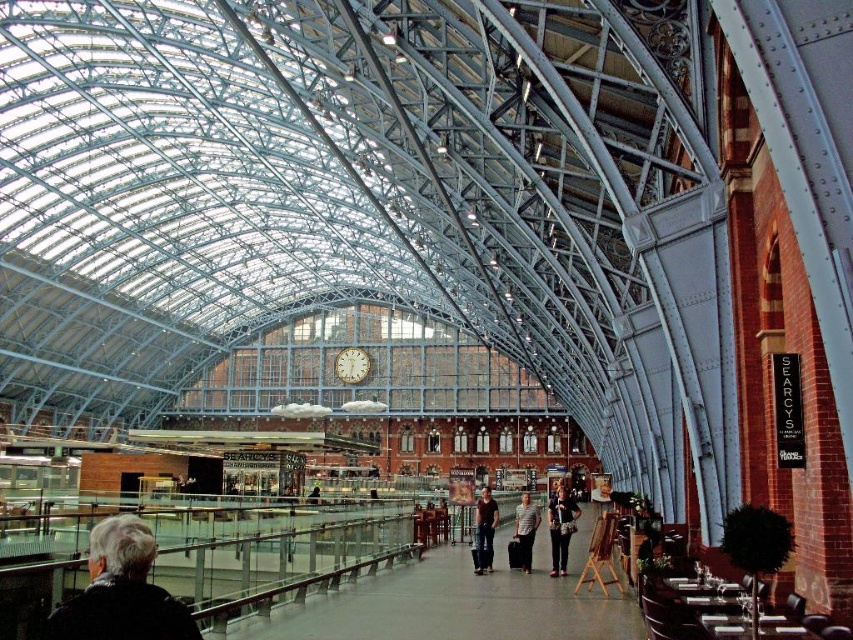
Who is lower down, gray fabric jacket at lower left or striped shirt at center?

striped shirt at center is lower down.

Is point (132, 636) less distant than point (524, 504)?

Yes, it is in front of point (524, 504).

Is point (114, 548) farther from viewer compared to point (521, 531)?

That is False.

You are a GUI agent. You are given a task and a screenshot of the screen. Output one action in this format:
    pyautogui.click(x=<x>, y=<y>)
    Task: Click on the gray fabric jacket at lower left
    
    Given the screenshot: What is the action you would take?
    pyautogui.click(x=120, y=589)

Which is above, matte black jacket at center or striped shirt at center?

striped shirt at center is above.

Between point (556, 525) and point (529, 508), which one is positioned behind?

The point (529, 508) is more distant.

The width and height of the screenshot is (853, 640). Find the location of `matte black jacket at center`. matte black jacket at center is located at coordinates point(560,528).

Which is more to the right, dark brown leather pants at center or striped shirt at center?

striped shirt at center

Which is more to the left, dark brown leather pants at center or striped shirt at center?

Positioned to the left is dark brown leather pants at center.

What do you see at coordinates (485, 531) in the screenshot? The height and width of the screenshot is (640, 853). I see `dark brown leather pants at center` at bounding box center [485, 531].

This screenshot has width=853, height=640. I want to click on dark brown leather pants at center, so click(485, 531).